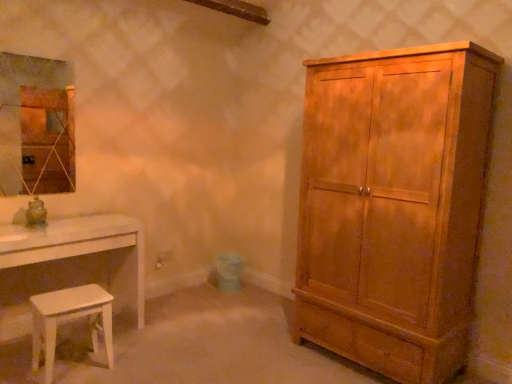
The image size is (512, 384). Find the location of `free point above white glossy table at lower left (from a real-world perspective)`. free point above white glossy table at lower left (from a real-world perspective) is located at coordinates (66, 223).